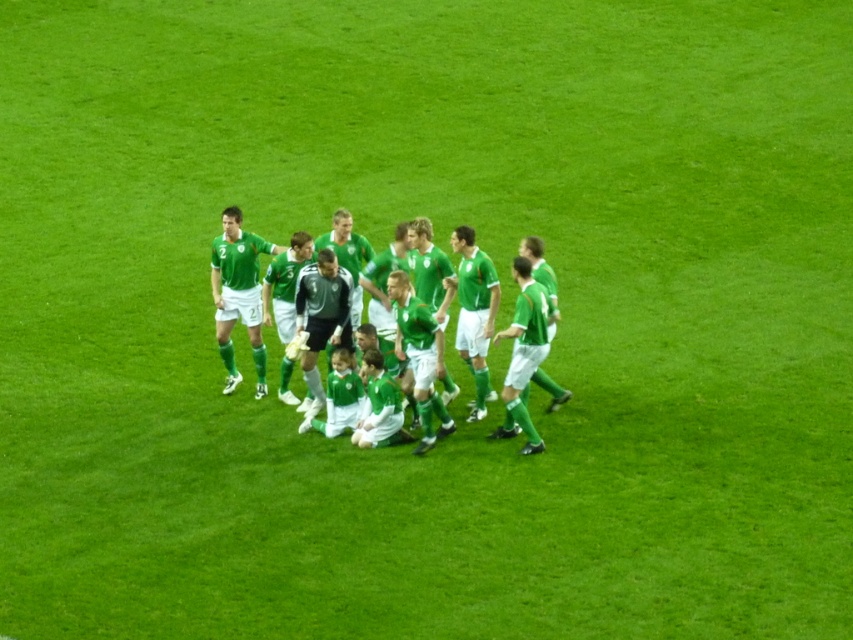
Question: Considering the real-world distances, which object is farthest from the black jersey at center?

Choices:
 (A) green jersey at center
 (B) matte green jersey at center

Answer: (B)

Question: Is green jersey at center above matte green jersey at center?

Choices:
 (A) yes
 (B) no

Answer: (A)

Question: Does green jersey at center appear under black jersey at center?

Choices:
 (A) no
 (B) yes

Answer: (A)

Question: Does green jersey at center have a greater width compared to black jersey at center?

Choices:
 (A) no
 (B) yes

Answer: (B)

Question: Which point is closer to the camera taking this photo?

Choices:
 (A) pyautogui.click(x=334, y=234)
 (B) pyautogui.click(x=299, y=280)

Answer: (B)

Question: Which point appears farthest from the camera in this image?

Choices:
 (A) (227, 278)
 (B) (294, 296)
 (C) (550, 404)

Answer: (A)